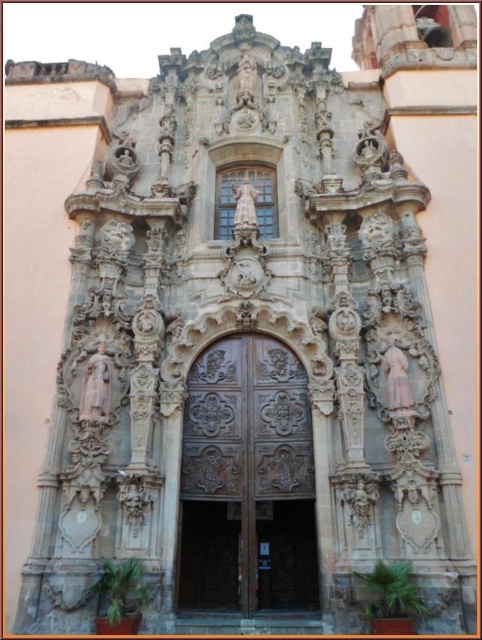
Question: Which object is positioned closest to the brown carved wood door at center?

Choices:
 (A) white marble statue at center
 (B) pink marble statue at upper left

Answer: (B)

Question: Is brown carved wood door at center smaller than pink marble statue at upper left?

Choices:
 (A) no
 (B) yes

Answer: (A)

Question: Is pink marble statue at upper left bigger than white marble statue at center?

Choices:
 (A) yes
 (B) no

Answer: (B)

Question: Based on their relative distances, which object is farther from the pink marble statue at upper left?

Choices:
 (A) brown carved wood door at center
 (B) white marble statue at center

Answer: (B)

Question: Among these objects, which one is nearest to the camera?

Choices:
 (A) pink marble statue at upper left
 (B) brown carved wood door at center

Answer: (B)

Question: Is brown carved wood door at center further to the viewer compared to pink marble statue at upper left?

Choices:
 (A) no
 (B) yes

Answer: (A)